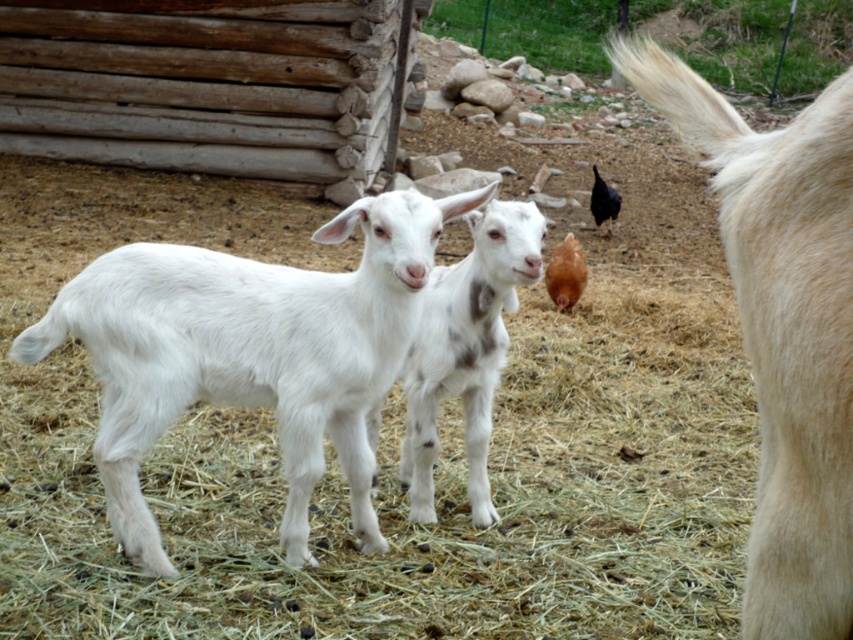
Question: Which point appears closest to the camera in this image?

Choices:
 (A) (514, 236)
 (B) (305, 438)

Answer: (B)

Question: Does white soft hay at center have a smaller size compared to white woolen goat at right?

Choices:
 (A) yes
 (B) no

Answer: (B)

Question: Which point appears closest to the camera in this image?

Choices:
 (A) (422, 236)
 (B) (793, 444)

Answer: (B)

Question: From the image, what is the correct spatial relationship of white woolen goat at center in relation to white soft fur goat at center?

Choices:
 (A) below
 (B) above

Answer: (B)

Question: Does white woolen goat at right appear on the left side of white soft fur goat at center?

Choices:
 (A) yes
 (B) no

Answer: (B)

Question: Which of the following is the closest to the observer?

Choices:
 (A) white soft fur goat at center
 (B) white soft hay at center
 (C) white woolen goat at right

Answer: (C)